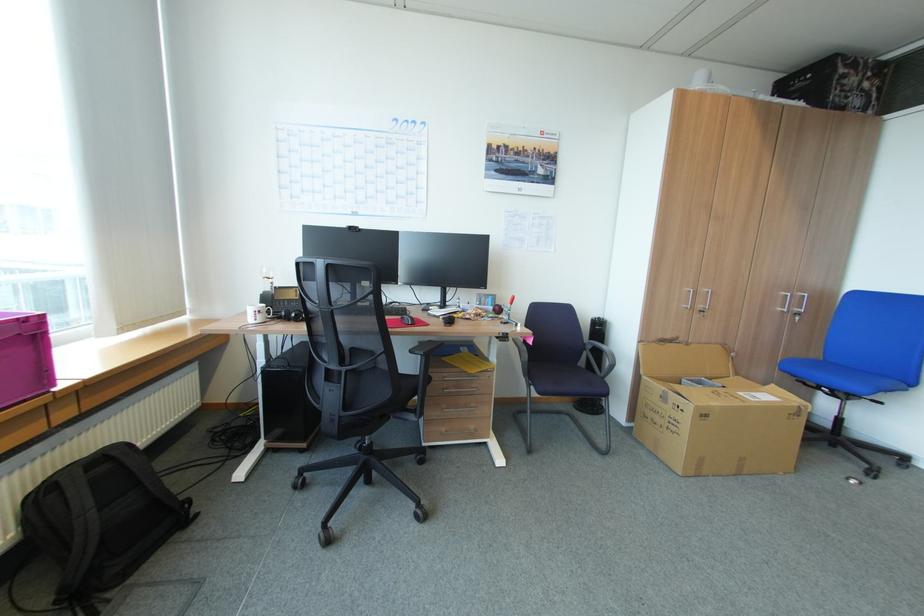
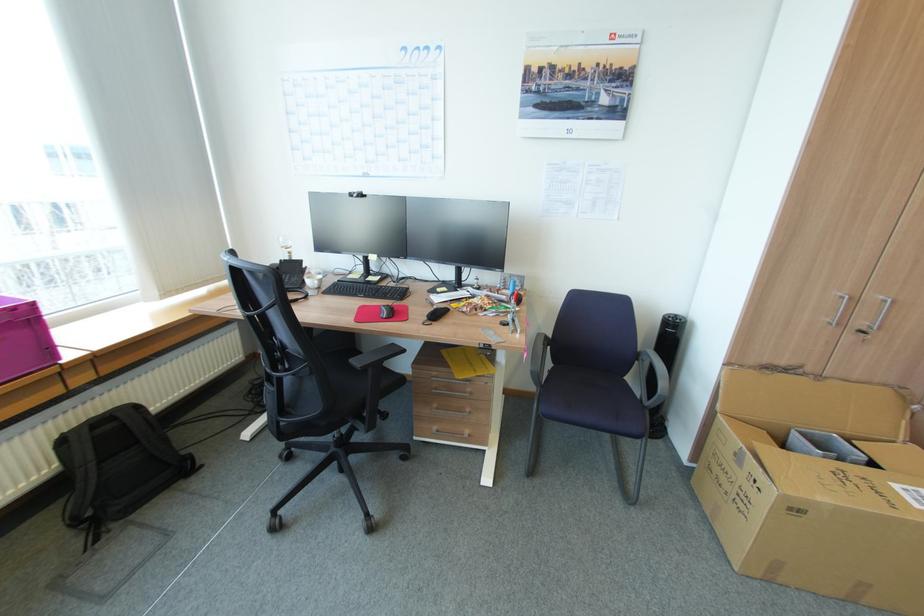
Locate, in the second image, the point that corresponds to (x=451, y=379) in the first image.

(438, 378)